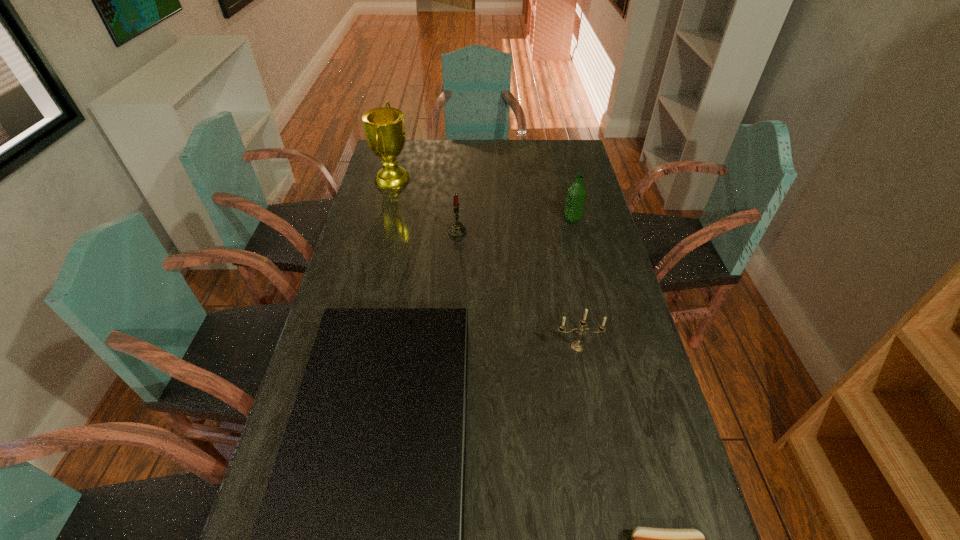
Where is `object located in the far edge section of the desktop`? This screenshot has height=540, width=960. object located in the far edge section of the desktop is located at coordinates (384, 128).

Locate an element on the screen. object that is at the left edge is located at coordinates (384, 128).

The width and height of the screenshot is (960, 540). I want to click on water bottle that is at the right edge, so (x=576, y=193).

This screenshot has width=960, height=540. Find the location of `candle that is at the right edge`. candle that is at the right edge is located at coordinates (577, 346).

Find the location of a particular element. This screenshot has width=960, height=540. object that is at the far left corner is located at coordinates (384, 128).

Where is `free space at the far edge`? free space at the far edge is located at coordinates (488, 149).

Image resolution: width=960 pixels, height=540 pixels. In the image, there is a desktop. Identify the location of vacant area at the left edge. (384, 238).

In order to click on free space at the right edge of the desktop in this screenshot , I will do point(578,291).

The height and width of the screenshot is (540, 960). I want to click on free space between the left candle and the fifth nearest object, so click(x=515, y=226).

Where is `vacant area that lies between the right candle and the farther candle`? The height and width of the screenshot is (540, 960). vacant area that lies between the right candle and the farther candle is located at coordinates (517, 289).